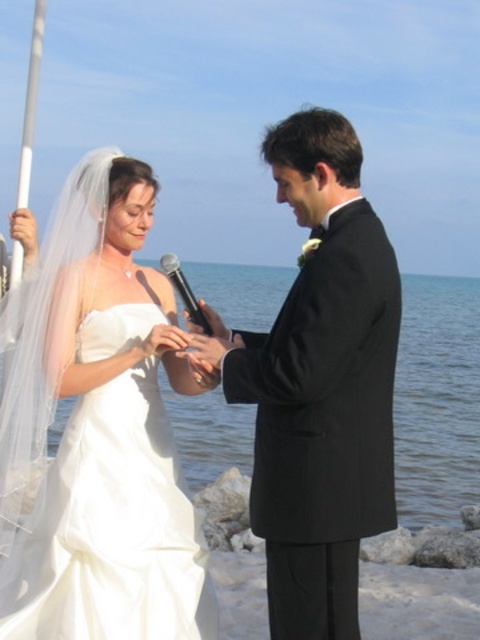
You are a photographer at the wedding, and you need to place two markers for the couple to stand on during the ceremony. The first marker is at point (x=164, y=262), and the second is at point (x=186, y=320). Which marker is closer to the camera?

Point (x=164, y=262) is closer to the viewer than point (x=186, y=320), so the first marker is closer to the camera.

You are a photographer at the wedding, and you want to capture a closeup of the microphone the bride is holding. Which microphone is closer to the camera? Please choose between the black metallic microphone at center and the black matte microphone at center.

The black metallic microphone at center is closer to the camera because it is further to the viewer than the black matte microphone at center.